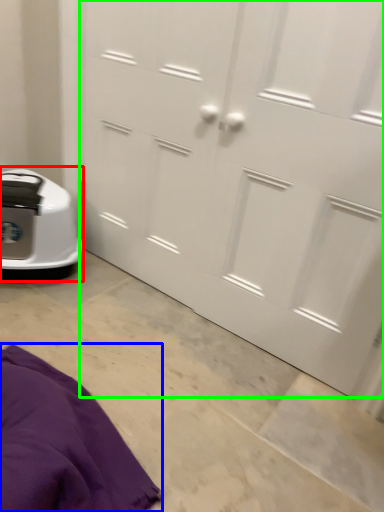
Question: Estimate the real-world distances between objects in this image. Which object is farther from home appliance (highlighted by a red box), blanket (highlighted by a blue box) or door (highlighted by a green box)?

Choices:
 (A) blanket
 (B) door

Answer: (A)